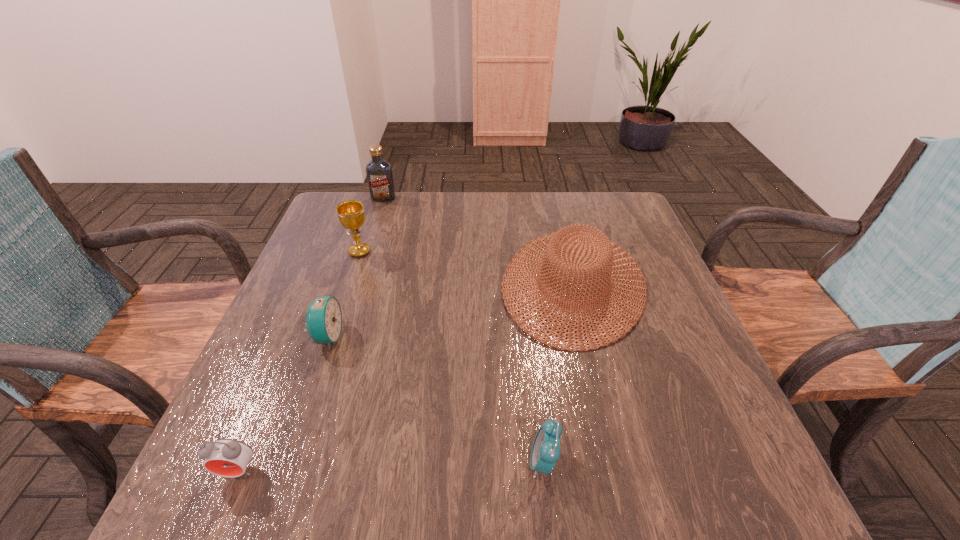
This screenshot has width=960, height=540. Find the location of `the tallest object`. the tallest object is located at coordinates (379, 173).

Find the location of a particular element. This screenshot has height=540, width=960. vodka is located at coordinates (379, 173).

Find the location of a particular element. the fifth shortest object is located at coordinates (351, 214).

This screenshot has height=540, width=960. What are the coordinates of `sunhat` in the screenshot? It's located at (552, 249).

This screenshot has height=540, width=960. What are the coordinates of `the second alarm clock from right to left` in the screenshot? It's located at (324, 317).

Where is `the leftmost alarm clock`? This screenshot has height=540, width=960. the leftmost alarm clock is located at coordinates (225, 457).

The height and width of the screenshot is (540, 960). I want to click on the rightmost alarm clock, so click(x=545, y=452).

What are the coordinates of `free space located on the front-facing side of the tallest object` in the screenshot? It's located at (373, 231).

Identify the location of vacant space located 0.260m on the right of the fifth shortest object. (471, 252).

Image resolution: width=960 pixels, height=540 pixels. In order to click on vacant space located on the left of the sunhat in this screenshot , I will do `click(390, 284)`.